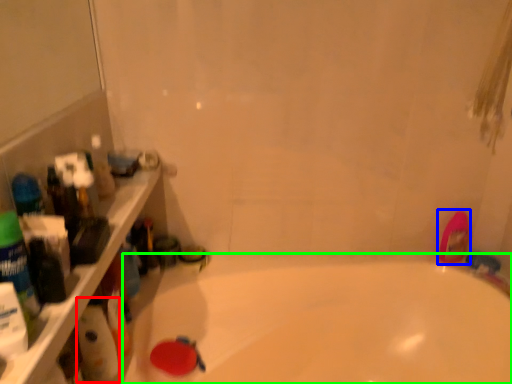
Question: Based on their relative distances, which object is nearer to cleaning product (highlighted by a red box)? Choose from mouthwash (highlighted by a blue box) and bathtub (highlighted by a green box).

Choices:
 (A) mouthwash
 (B) bathtub

Answer: (B)